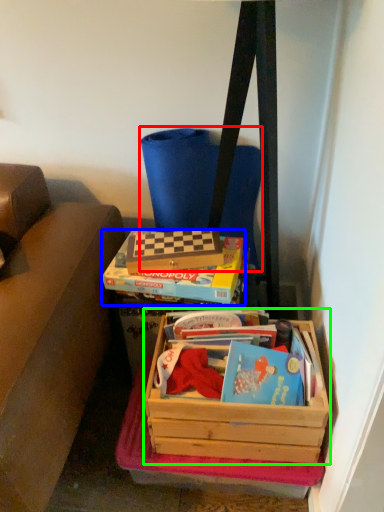
Question: Which object is the closest to the messenger bag (highlighted by a red box)? Choose among these: box (highlighted by a blue box) or box (highlighted by a green box).

Choices:
 (A) box
 (B) box

Answer: (A)